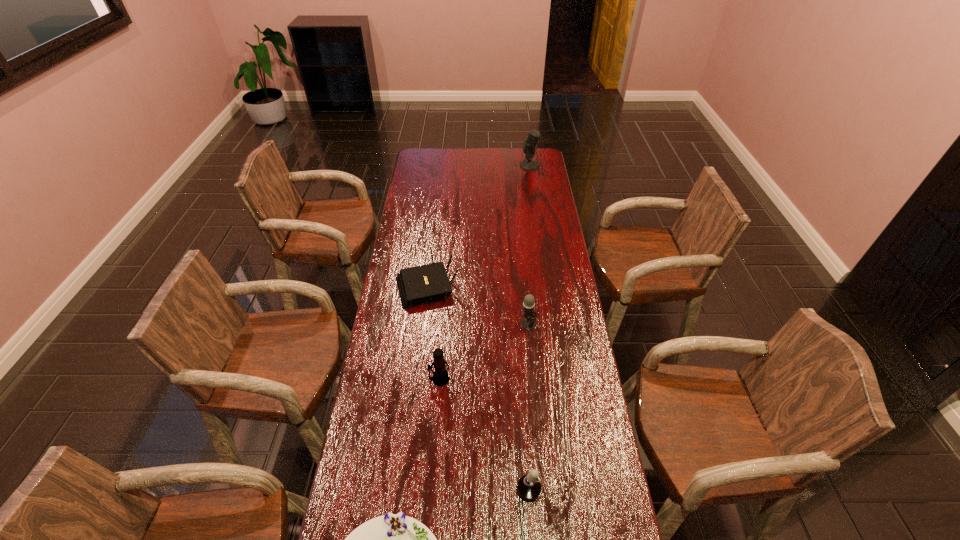
Find the location of a particular element. vacant point located between the fourth nearest object and the tallest microphone is located at coordinates (529, 245).

Identify the location of empty location between the farthest object and the fifth nearest object. (478, 225).

Where is `unoccupied area between the fifth nearest object and the third farthest microphone`? The image size is (960, 540). unoccupied area between the fifth nearest object and the third farthest microphone is located at coordinates (433, 332).

Image resolution: width=960 pixels, height=540 pixels. Find the location of `vacant area that lies between the third farthest object and the fifth nearest object`. vacant area that lies between the third farthest object and the fifth nearest object is located at coordinates (478, 305).

The width and height of the screenshot is (960, 540). Find the location of `vacant area between the nearest microphone and the farthest microphone`. vacant area between the nearest microphone and the farthest microphone is located at coordinates (538, 328).

The height and width of the screenshot is (540, 960). Find the location of `free spot between the tallest microphone and the third nearest microphone`. free spot between the tallest microphone and the third nearest microphone is located at coordinates (529, 245).

Identify which object is located as the fifth nearest to the farthest microphone. Please provide its 2D coordinates. Your answer should be formatted as a tuple, i.e. [(x, y)], where the tuple contains the x and y coordinates of a point satisfying the conditions above.

[(392, 539)]

Find the location of a particular element. This screenshot has height=540, width=960. object that is the fourth closest to the salad plate is located at coordinates (419, 285).

Locate an element on the screen. The image size is (960, 540). microphone that stands as the third closest to the second farthest microphone is located at coordinates (529, 145).

Identify which microphone is the second closest to the tallest microphone. Please provide its 2D coordinates. Your answer should be formatted as a tuple, i.e. [(x, y)], where the tuple contains the x and y coordinates of a point satisfying the conditions above.

[(440, 377)]